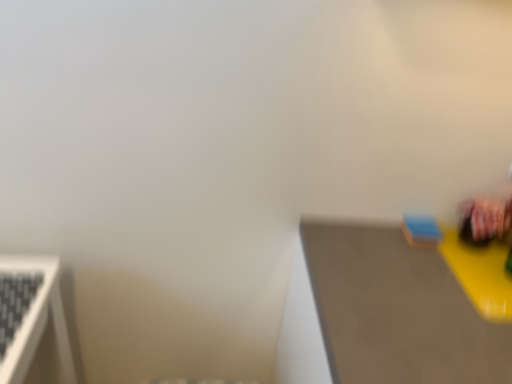
Locate an element on the screen. This screenshot has height=384, width=512. blank space to the left of matte plastic toy at right, which appears as the 2th toy when viewed from the left is located at coordinates (403, 248).